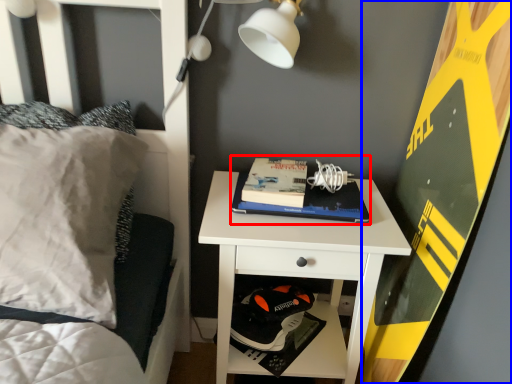
Question: Among these objects, which one is nearest to the camera, paperback book (highlighted by a red box) or bulletin board (highlighted by a blue box)?

Choices:
 (A) paperback book
 (B) bulletin board

Answer: (B)